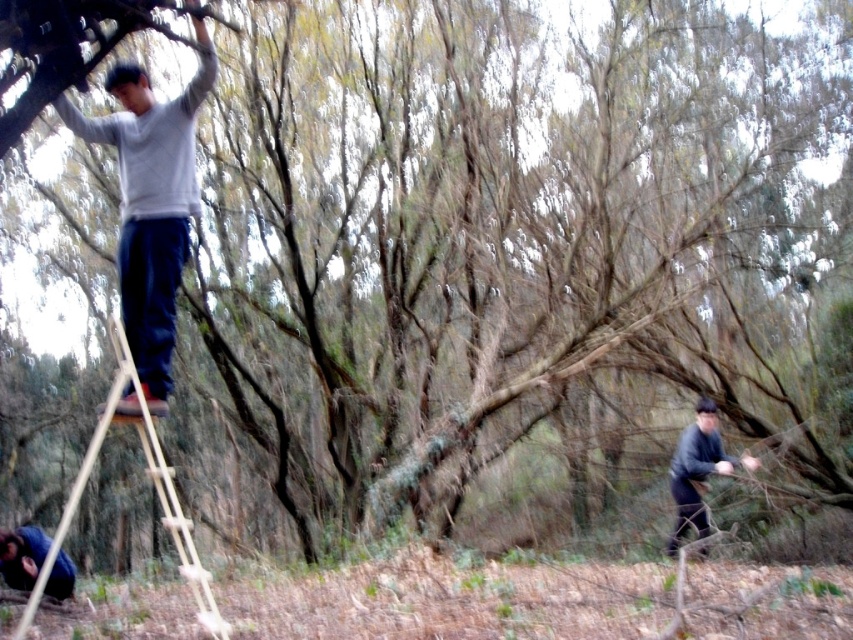
Is wooden natural ladder at upper left wider than blue denim jacket at lower left?

Indeed, wooden natural ladder at upper left has a greater width compared to blue denim jacket at lower left.

Is wooden natural ladder at upper left shorter than blue denim jacket at lower left?

In fact, wooden natural ladder at upper left may be taller than blue denim jacket at lower left.

Who is more forward, (187, 577) or (44, 540)?

Point (187, 577) is in front.

Identify the location of wooden natural ladder at upper left. (178, 524).

Is light gray sweater at upper left above blue denim jacket at lower left?

Indeed, light gray sweater at upper left is positioned over blue denim jacket at lower left.

Who is positioned more to the left, light gray sweater at upper left or blue denim jacket at lower left?

Positioned to the left is blue denim jacket at lower left.

Who is more distant from viewer, [137,124] or [24,572]?

Positioned behind is point [24,572].

This screenshot has width=853, height=640. What are the coordinates of `light gray sweater at upper left` in the screenshot? It's located at (149, 204).

Is light gray sweater at upper left closer to the viewer compared to wooden natural ladder at upper left?

No.

Can you confirm if light gray sweater at upper left is wider than wooden natural ladder at upper left?

In fact, light gray sweater at upper left might be narrower than wooden natural ladder at upper left.

Is point (192, 160) closer to viewer compared to point (96, 451)?

No, (192, 160) is behind (96, 451).

Image resolution: width=853 pixels, height=640 pixels. Identify the location of light gray sweater at upper left. (149, 204).